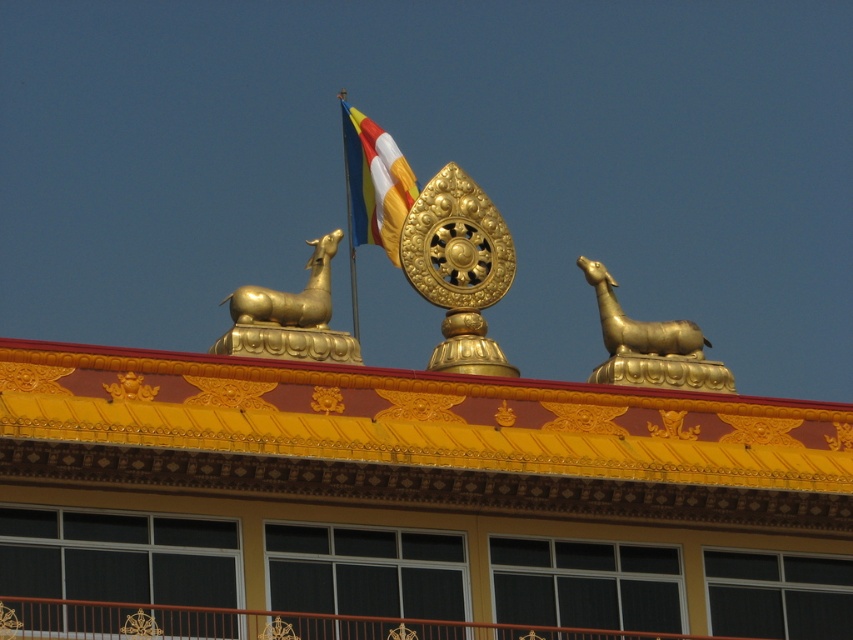
You are an architect designing a new building inspired by this traditional style. You need to place a golden deer statue exactly where the gold polished deer at upper right is located in the image. What are the coordinates for placing the statue?

The coordinates for placing the gold polished deer at upper right are at point (650, 346).

You are an architect examining the building from the ground. You notice two gold polished statues on the roof. Which one is positioned closer to you, the gold polished statue at upper left or the gold polished deer at upper right?

The gold polished statue at upper left is closer to the viewer than the gold polished deer at upper right.

You are an architect examining the roof of this building. You notice two gold polished statues on the roof peak. Which one is taller between the gold polished statue at upper left and the gold polished deer at upper right?

The gold polished deer at upper right is taller than the gold polished statue at upper left.